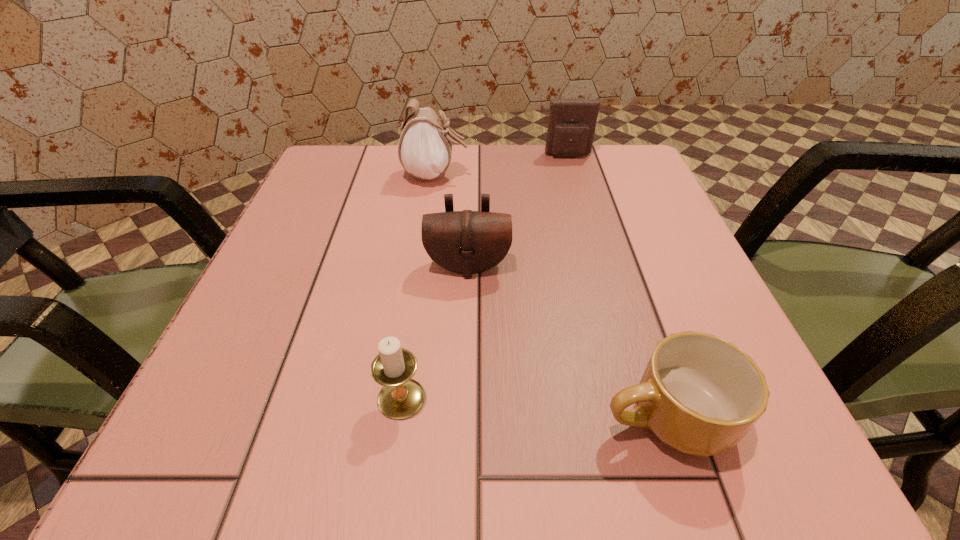
The image size is (960, 540). Identify the location of vacant region at the far edge of the desktop. (473, 169).

Where is `vacant area at the near edge of the desktop`? The image size is (960, 540). vacant area at the near edge of the desktop is located at coordinates (616, 441).

The height and width of the screenshot is (540, 960). Find the location of `blank area at the left edge`. blank area at the left edge is located at coordinates (291, 300).

The height and width of the screenshot is (540, 960). Identify the location of free space at the right edge. (652, 239).

In order to click on vacant space at the far right corner of the desktop in this screenshot , I will do `click(628, 176)`.

Identify the location of free spot between the third farthest object and the candle holder. (435, 332).

Locate an element on the screen. The width and height of the screenshot is (960, 540). free space between the mug and the candle holder is located at coordinates (534, 408).

You are a GUI agent. You are given a task and a screenshot of the screen. Output one action in this format:
    pyautogui.click(x=<x>, y=<y>)
    Task: Click on the vacant area between the tallest object and the candle holder
    
    Given the screenshot: What is the action you would take?
    pyautogui.click(x=419, y=287)

Locate an element on the screen. The height and width of the screenshot is (540, 960). empty space between the farthest object and the second farthest object is located at coordinates (502, 165).

Where is `free area in between the third nearest object and the rightmost pouch`? The width and height of the screenshot is (960, 540). free area in between the third nearest object and the rightmost pouch is located at coordinates (518, 211).